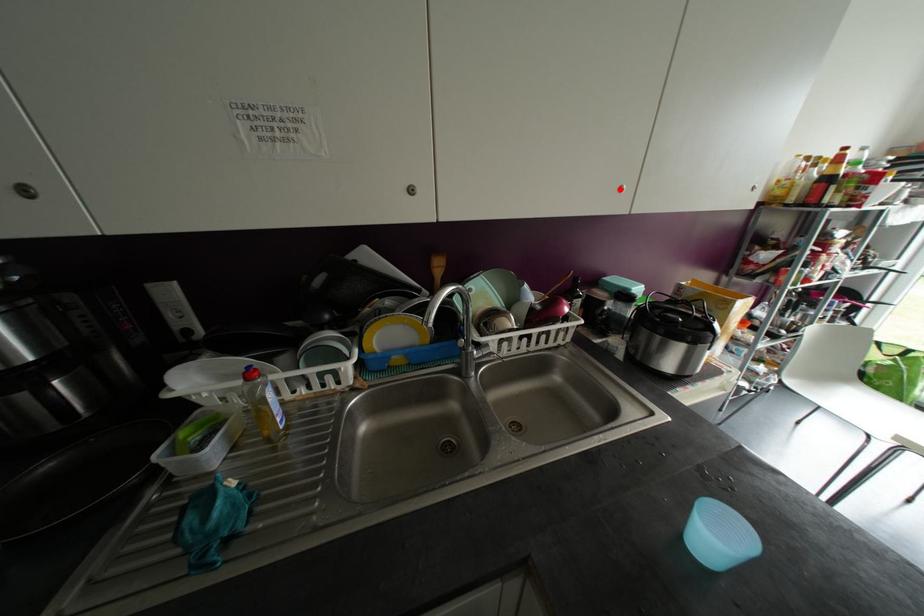
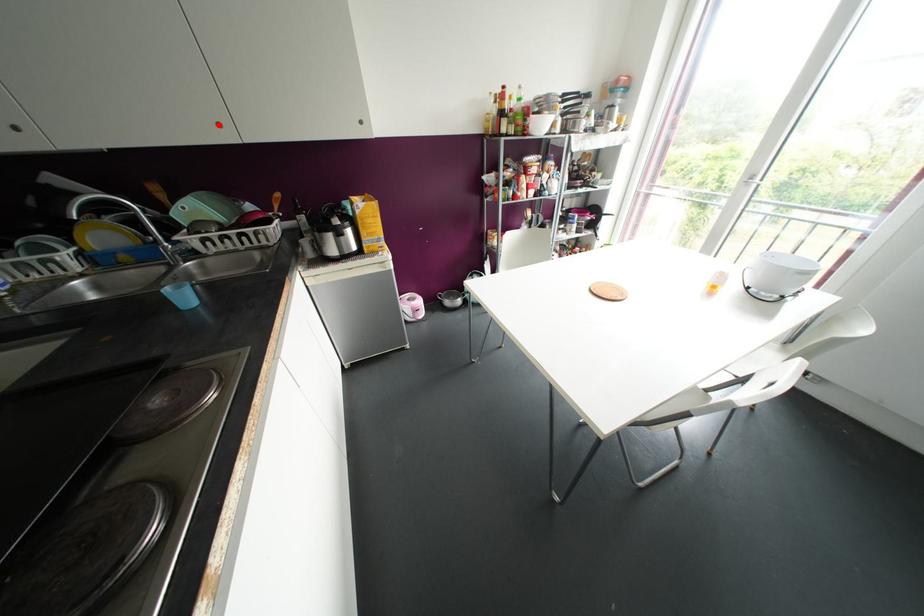
I am providing you with two images of the same scene from different viewpoints. A red point is marked on the first image and another point is marked on the second image. Is the red point in image1 aligned with the point shown in image2?

Yes